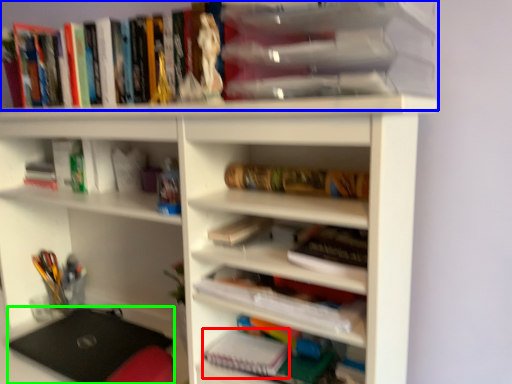
Question: Which object is positioned farthest from paperback book (highlighted by a red box)? Select from book (highlighted by a blue box) and laptop (highlighted by a green box).

Choices:
 (A) book
 (B) laptop

Answer: (A)